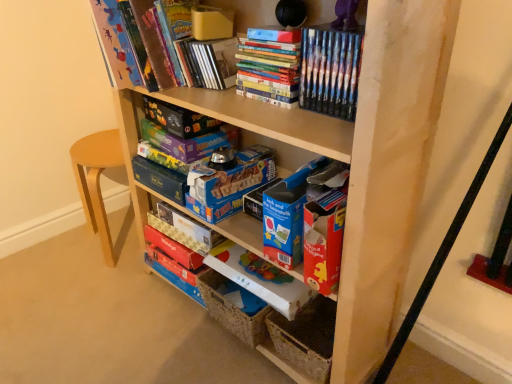
The image size is (512, 384). Find the location of `hardcover book at upper center, the 7th paperback book positioned from the bottom`. hardcover book at upper center, the 7th paperback book positioned from the bottom is located at coordinates (208, 62).

In order to face matte board game at upper center, the 6th paperback book from the bottom, should I rotate leftwards or rightwards?

You should rotate left by 10.013 degrees.

Where is `blue cardboard storage box at lower center`? This screenshot has height=384, width=512. blue cardboard storage box at lower center is located at coordinates (231, 311).

Find the location of a particular element. The height and width of the screenshot is (384, 512). matte purple board game at center, positioned as the 5th paperback book in bottom-to-top order is located at coordinates (185, 142).

What are the coordinates of `wooden shelf at center` in the screenshot? It's located at (342, 157).

You are a GUI agent. You are given a task and a screenshot of the screen. Output one action in this format:
    pyautogui.click(x=<x>, y=<y>)
    Task: Click on the hardcover book at upper center, which is the 2th book from right to left
    Image resolution: width=512 pixels, height=384 pixels.
    Given the screenshot: What is the action you would take?
    pyautogui.click(x=132, y=43)

Image resolution: width=512 pixels, height=384 pixels. Find the location of `hardcover book at upper center, the 7th paperback book positioned from the bottom`. hardcover book at upper center, the 7th paperback book positioned from the bottom is located at coordinates (208, 62).

Is wooden shelf at center oriented away from matte purple board game at center, the fourth paperback book from the top?

Yes, matte purple board game at center, the fourth paperback book from the top, is at the back of wooden shelf at center.

How different are the orientations of wooden shelf at center and matte purple board game at center, the fourth paperback book from the top, in degrees?

They differ by 3.27 degrees in their facing directions.

Considering the positions of point (383, 199) and point (178, 170), is point (383, 199) closer or farther from the camera than point (178, 170)?

Point (383, 199) appears to be closer to the viewer than point (178, 170).

In the image, is wooden shelf at center on the left side or the right side of matte purple board game at center, the 4th paperback book from the bottom?

wooden shelf at center is positioned on matte purple board game at center, the 4th paperback book from the bottom,'s right side.

Considering the sizes of objects blue cardboard storage box at lower center and matte purple board game at center, which is the third paperback book from top to bottom, in the image provided, who is wider, blue cardboard storage box at lower center or matte purple board game at center, which is the third paperback book from top to bottom,?

blue cardboard storage box at lower center is wider.

Between blue cardboard storage box at lower center and matte purple board game at center, positioned as the 5th paperback book in bottom-to-top order, which one has less height?

matte purple board game at center, positioned as the 5th paperback book in bottom-to-top order.

Is blue cardboard storage box at lower center directly adjacent to matte purple board game at center, positioned as the 5th paperback book in bottom-to-top order?

No, blue cardboard storage box at lower center is not beside matte purple board game at center, positioned as the 5th paperback book in bottom-to-top order.

Considering the positions of objects blue cardboard storage box at lower center and matte purple board game at center, positioned as the 5th paperback book in bottom-to-top order, in the image provided, who is in front, blue cardboard storage box at lower center or matte purple board game at center, positioned as the 5th paperback book in bottom-to-top order,?

blue cardboard storage box at lower center.

Is the position of matte purple board game at center, positioned as the 5th paperback book in bottom-to-top order, less distant than that of matte board game at upper center, acting as the second paperback book starting from the top?

No, the depth of matte purple board game at center, positioned as the 5th paperback book in bottom-to-top order, is greater than that of matte board game at upper center, acting as the second paperback book starting from the top.

Is point (175, 142) positioned in front of point (179, 129)?

No, it is behind (179, 129).

You are a GUI agent. You are given a task and a screenshot of the screen. Output one action in this format:
    pyautogui.click(x=<x>, y=<y>)
    Task: Click on the 1st paperback book counting from the left side of the matte purple board game at center, positioned as the 5th paperback book in bottom-to-top order
    The image size is (512, 384).
    Given the screenshot: What is the action you would take?
    pyautogui.click(x=178, y=119)

Looking at this image, can you confirm if matte purple board game at center, which is the third paperback book from top to bottom, is shorter than matte board game at upper center, acting as the second paperback book starting from the top?

Indeed, matte purple board game at center, which is the third paperback book from top to bottom, has a lesser height compared to matte board game at upper center, acting as the second paperback book starting from the top.

In terms of height, does hardcover book at upper center, which is counted as the 1th book, starting from the left, look taller or shorter compared to blue cardboard book at center, arranged as the 7th paperback book when viewed from the top?

Considering their sizes, hardcover book at upper center, which is counted as the 1th book, starting from the left, has more height than blue cardboard book at center, arranged as the 7th paperback book when viewed from the top.

Which of these two, hardcover book at upper center, which is the 2th book from right to left, or blue cardboard book at center, arranged as the 7th paperback book when viewed from the top, is smaller?

With smaller size is blue cardboard book at center, arranged as the 7th paperback book when viewed from the top.

Could you tell me if hardcover book at upper center, which is the 2th book from right to left, is turned towards blue cardboard book at center, arranged as the 7th paperback book when viewed from the top?

No, hardcover book at upper center, which is the 2th book from right to left, does not turn towards blue cardboard book at center, arranged as the 7th paperback book when viewed from the top.

Is hardcover book at upper center, acting as the 1th paperback book starting from the top, turned away from blue cardboard box at center, acting as the 5th paperback book starting from the top?

No, hardcover book at upper center, acting as the 1th paperback book starting from the top, is not facing away from blue cardboard box at center, acting as the 5th paperback book starting from the top.

From the image's perspective, does hardcover book at upper center, the 7th paperback book positioned from the bottom, appear higher than blue cardboard box at center, acting as the 5th paperback book starting from the top?

Correct, hardcover book at upper center, the 7th paperback book positioned from the bottom, appears higher than blue cardboard box at center, acting as the 5th paperback book starting from the top, in the image.

Is hardcover book at upper center, acting as the 1th paperback book starting from the top, outside of blue cardboard box at center, the third paperback book ordered from the bottom?

Yes, hardcover book at upper center, acting as the 1th paperback book starting from the top, is outside of blue cardboard box at center, the third paperback book ordered from the bottom.

Is point (194, 42) more distant than point (232, 187)?

That is False.

Can you confirm if matte purple board game at center, which is the third paperback book from top to bottom, is positioned to the left of matte purple board game at center, the fourth paperback book from the top?

Incorrect, matte purple board game at center, which is the third paperback book from top to bottom, is not on the left side of matte purple board game at center, the fourth paperback book from the top.

Based on their sizes in the image, would you say matte purple board game at center, positioned as the 5th paperback book in bottom-to-top order, is bigger or smaller than matte purple board game at center, the fourth paperback book from the top?

Considering their sizes, matte purple board game at center, positioned as the 5th paperback book in bottom-to-top order, takes up more space than matte purple board game at center, the fourth paperback book from the top.

Is matte purple board game at center, positioned as the 5th paperback book in bottom-to-top order, next to matte purple board game at center, the fourth paperback book from the top, and touching it?

Yes, matte purple board game at center, positioned as the 5th paperback book in bottom-to-top order, is next to matte purple board game at center, the fourth paperback book from the top.

From a real-world perspective, is matte purple board game at center, which is the third paperback book from top to bottom, positioned under matte purple board game at center, the 4th paperback book from the bottom, based on gravity?

Incorrect, from a real-world perspective, matte purple board game at center, which is the third paperback book from top to bottom, is higher than matte purple board game at center, the 4th paperback book from the bottom.

Would you say matte purple board game at center, the 4th paperback book from the bottom, is a long distance from hardcover book at upper center, the 7th paperback book positioned from the bottom?

No, there isn't a large distance between matte purple board game at center, the 4th paperback book from the bottom, and hardcover book at upper center, the 7th paperback book positioned from the bottom.

From a real-world perspective, is matte purple board game at center, the 4th paperback book from the bottom, on top of hardcover book at upper center, acting as the 1th paperback book starting from the top?

Incorrect, from a real-world perspective, matte purple board game at center, the 4th paperback book from the bottom, is lower than hardcover book at upper center, acting as the 1th paperback book starting from the top.

Considering the relative sizes of matte purple board game at center, the fourth paperback book from the top, and hardcover book at upper center, the 7th paperback book positioned from the bottom, in the image provided, is matte purple board game at center, the fourth paperback book from the top, bigger than hardcover book at upper center, the 7th paperback book positioned from the bottom,?

Incorrect, matte purple board game at center, the fourth paperback book from the top, is not larger than hardcover book at upper center, the 7th paperback book positioned from the bottom.

Is matte purple board game at center, the 4th paperback book from the bottom, in front of hardcover book at upper center, the 7th paperback book positioned from the bottom?

No, the depth of matte purple board game at center, the 4th paperback book from the bottom, is greater than that of hardcover book at upper center, the 7th paperback book positioned from the bottom.

Starting from the wooden shelf at center, which paperback book is the 5th one to the left? Please provide its 2D coordinates.

[(167, 158)]

At what (x,y) coordinates should I click in order to perform the action: click on storage box on the right side of matte purple board game at center, positioned as the 5th paperback book in bottom-to-top order. Please return your answer as a coordinate pair (x, y). Image resolution: width=512 pixels, height=384 pixels. Looking at the image, I should click on (231, 311).

Estimate the real-world distances between objects in this image. Which object is further from blue cardboard box at center, the third paperback book ordered from the bottom, hardcover book at upper center, which is the 2th book from right to left, or hardcover books at upper center, the second book positioned from the left?

hardcover book at upper center, which is the 2th book from right to left, lies further to blue cardboard box at center, the third paperback book ordered from the bottom, than the other object.

Looking at this image, from the image, which object appears to be nearer to blue cardboard box at center, the third paperback book ordered from the bottom, hardcover book at upper center, which is counted as the 1th book, starting from the left, or blue cardboard book at center, which ranks as the 1th paperback book in bottom-to-top order?

blue cardboard book at center, which ranks as the 1th paperback book in bottom-to-top order.

When comparing their distances from wooden shelf at center, does blue cardboard storage box at lower center or hardcover book at upper center, which is the 2th book from right to left, seem further?

Based on the image, blue cardboard storage box at lower center appears to be further to wooden shelf at center.

Which object lies nearer to the anchor point matte cardboard book at center, the 2th paperback book in the bottom-to-top sequence, blue cardboard storage box at lower center or matte purple board game at center, which is the third paperback book from top to bottom?

blue cardboard storage box at lower center lies closer to matte cardboard book at center, the 2th paperback book in the bottom-to-top sequence, than the other object.

Estimate the real-world distances between objects in this image. Which object is further from hardcover book at upper center, which is the 2th book from right to left, wooden shelf at center or blue cardboard box at center, the third paperback book ordered from the bottom?

blue cardboard box at center, the third paperback book ordered from the bottom, lies further to hardcover book at upper center, which is the 2th book from right to left, than the other object.

Which object lies nearer to the anchor point hardcover book at upper center, which is the 2th book from right to left, matte purple board game at center, which is the third paperback book from top to bottom, or wooden shelf at center?

The object closer to hardcover book at upper center, which is the 2th book from right to left, is matte purple board game at center, which is the third paperback book from top to bottom.

Looking at the image, which one is located closer to matte purple board game at center, which is the third paperback book from top to bottom, blue cardboard storage box at lower center or matte purple board game at center, the fourth paperback book from the top?

matte purple board game at center, the fourth paperback book from the top, lies closer to matte purple board game at center, which is the third paperback book from top to bottom, than the other object.

From the image, which object appears to be farther from hardcover book at upper center, which is counted as the 1th book, starting from the left, hardcover book at upper center, acting as the 1th paperback book starting from the top, or matte board game at upper center, acting as the second paperback book starting from the top?

matte board game at upper center, acting as the second paperback book starting from the top, is positioned further to the anchor hardcover book at upper center, which is counted as the 1th book, starting from the left.

Identify the location of shelf between hardcover book at upper center, the 7th paperback book positioned from the bottom, and blue cardboard storage box at lower center in the up-down direction. (x=342, y=157).

At what (x,y) coordinates should I click in order to perform the action: click on book between hardcover book at upper center, which is counted as the 1th book, starting from the left, and blue cardboard box at center, acting as the 5th paperback book starting from the top, from top to bottom. Please return your answer as a coordinate pair (x, y). The image size is (512, 384). Looking at the image, I should click on (269, 66).

Where is `paperback book between matte purple board game at center, the 4th paperback book from the bottom, and matte cardboard book at center, the 2th paperback book in the bottom-to-top sequence, from top to bottom`? The height and width of the screenshot is (384, 512). paperback book between matte purple board game at center, the 4th paperback book from the bottom, and matte cardboard book at center, the 2th paperback book in the bottom-to-top sequence, from top to bottom is located at coordinates (228, 183).

The image size is (512, 384). I want to click on shelf between hardcover book at upper center, which is the 2th book from right to left, and blue cardboard storage box at lower center in the up-down direction, so click(x=342, y=157).